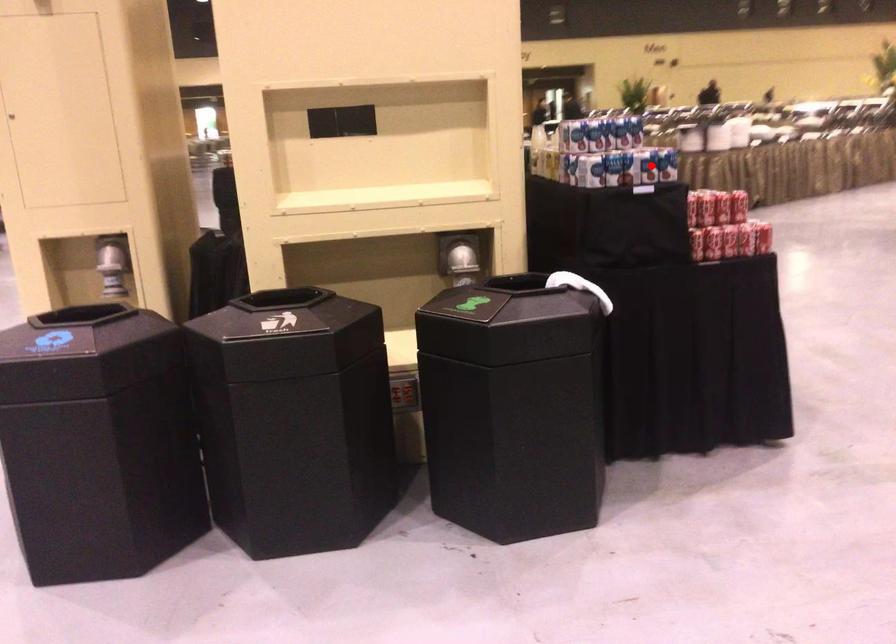
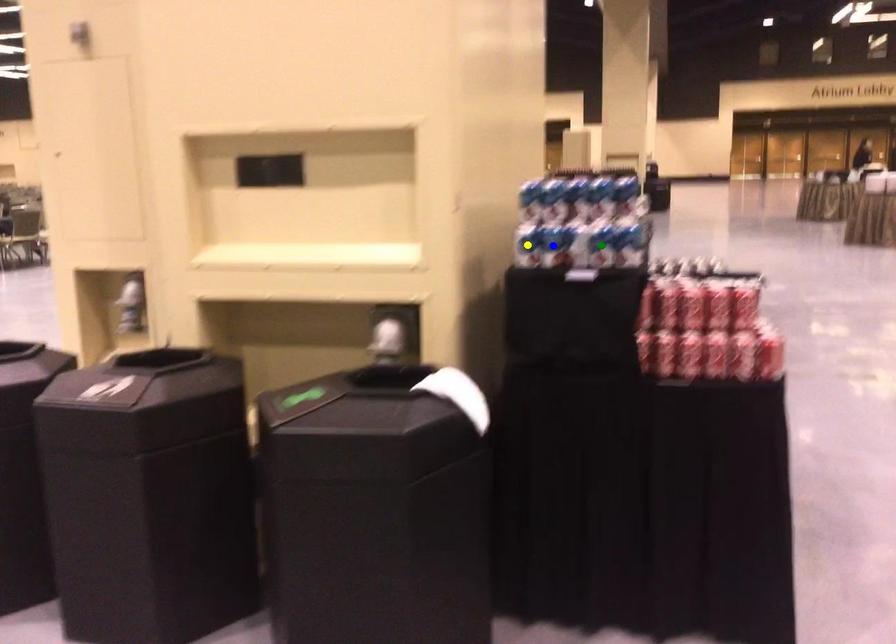
Question: I am providing you with two images of the same scene from different viewpoints. A red point is marked on the first image. You are given multiple points on the second image. Which mark in image 2 goes with the point in image 1?

Choices:
 (A) blue point
 (B) yellow point
 (C) green point

Answer: (C)